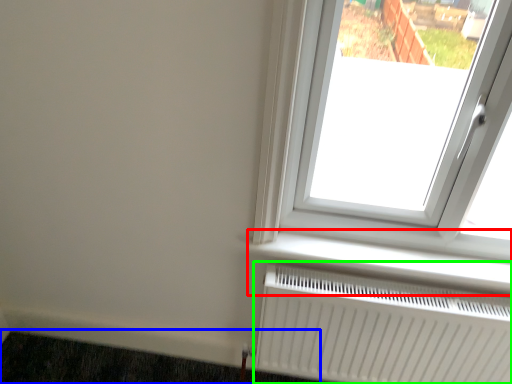
Question: Which object is positioned farthest from window sill (highlighted by a red box)? Select from doormat (highlighted by a blue box) and radiator (highlighted by a green box).

Choices:
 (A) doormat
 (B) radiator

Answer: (A)